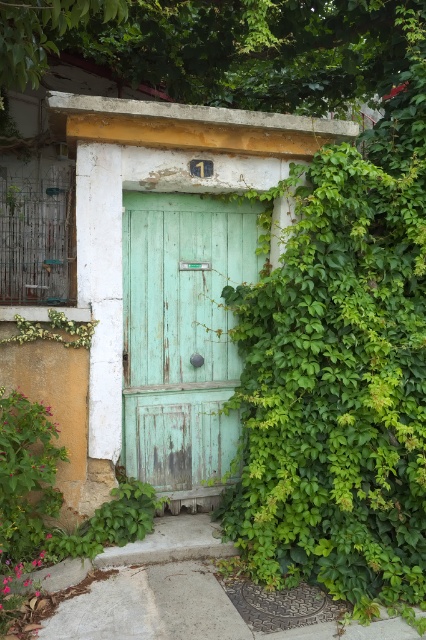
You are a delivery person trying to deliver a package to the address shown in the image. You see two doors labeled green wooden door at center and green matte door at center. Which door should you use for delivery?

The green wooden door at center is larger in size than the green matte door at center, so the delivery person should use the green wooden door at center for delivery since it is more likely to be the main entrance.